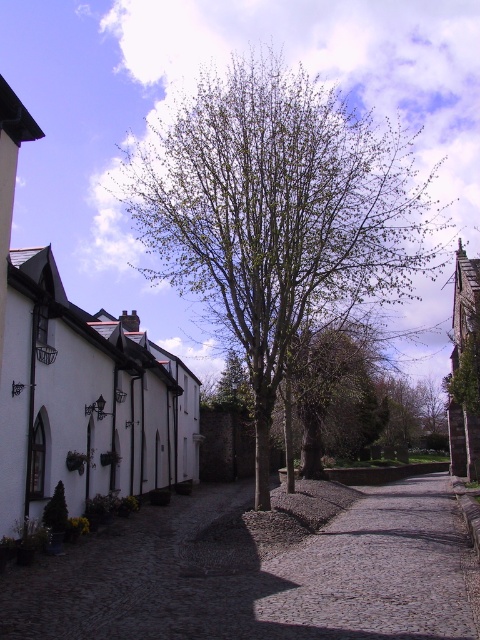
Does dark cobblestone path at center have a greater width compared to cobblestone path at center?

Indeed, dark cobblestone path at center has a greater width compared to cobblestone path at center.

Who is more distant from viewer, (471,580) or (435,632)?

The point (471,580) is behind.

Find the location of a particular element. dark cobblestone path at center is located at coordinates (262, 570).

Is point (235, 122) closer to viewer compared to point (420, 561)?

No, it is behind (420, 561).

Does green leafy tree at center appear on the right side of cobblestone path at center?

Incorrect, green leafy tree at center is not on the right side of cobblestone path at center.

Is point (289, 177) positioned before point (364, 538)?

No, it is not.

Where is `green leafy tree at center`? Image resolution: width=480 pixels, height=640 pixels. green leafy tree at center is located at coordinates (278, 214).

Who is positioned more to the left, green leafy tree at center or dark cobblestone path at center?

green leafy tree at center is more to the left.

Is point (289, 252) positioned after point (136, 522)?

No.

Locate an element on the screen. This screenshot has width=480, height=640. green leafy tree at center is located at coordinates (278, 214).